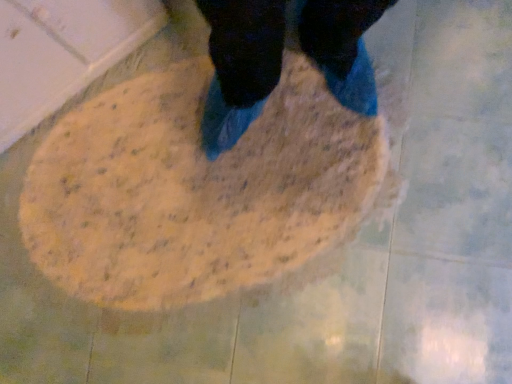
Where is `blank area beneath beige textured rug at center (from a real-world perspective)`? This screenshot has height=384, width=512. blank area beneath beige textured rug at center (from a real-world perspective) is located at coordinates (190, 190).